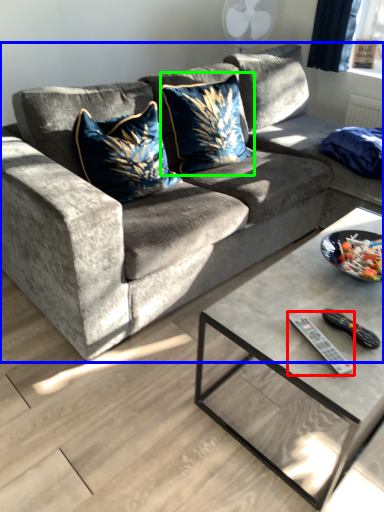
Question: Considering the real-world distances, which object is closest to remote (highlighted by a red box)? studio couch (highlighted by a blue box) or throw pillow (highlighted by a green box).

Choices:
 (A) studio couch
 (B) throw pillow

Answer: (A)